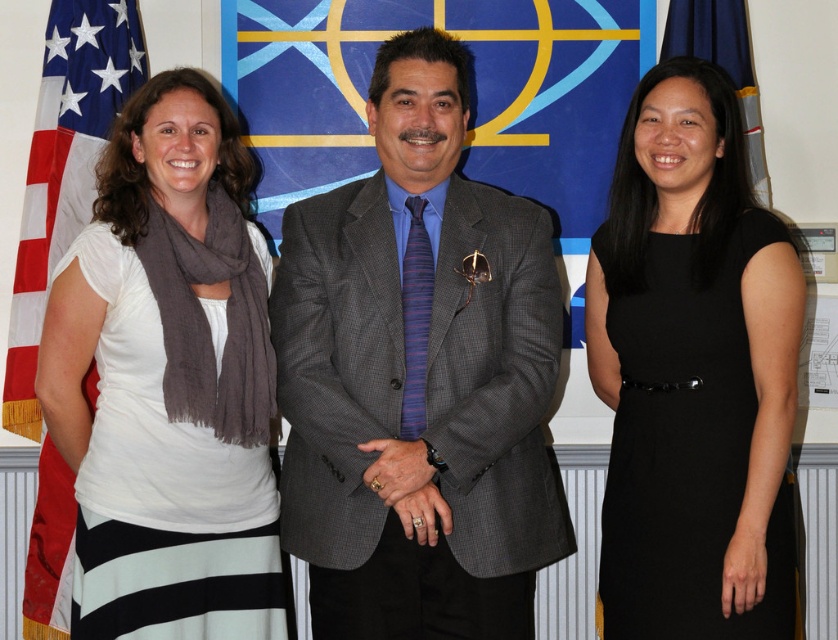
Consider the image. You are a photographer adjusting the camera settings. You need to focus on the white cotton scarf at left and the blue fabric flag at upper right. Which object should you adjust the focus for first if you want to capture both clearly in the same shot?

The white cotton scarf at left has a larger size compared to the blue fabric flag at upper right, so you should focus on the white cotton scarf at left first to ensure its details are sharp before adjusting for the smaller flag.

You are standing in front of the three people in the image. You want to hand a gift to the person wearing the black satin dress at right without moving your position. Can you reach them?

The black satin dress at right and the viewer are 2.41 meters apart from each other. Since the distance is greater than the typical human arm length of around 1.5 meters, you cannot reach them without moving.

You are a photographer setting up for a group photo. You have to ensure that the gray textured suit at center and the white cotton scarf at left are both clearly visible in the frame. Based on their sizes, which object might require more attention to avoid being cropped out?

The gray textured suit at center is wider than the white cotton scarf at left, so the gray textured suit at center might require more attention to avoid being cropped out since it is larger and could be more likely to go out of frame if not positioned carefully.